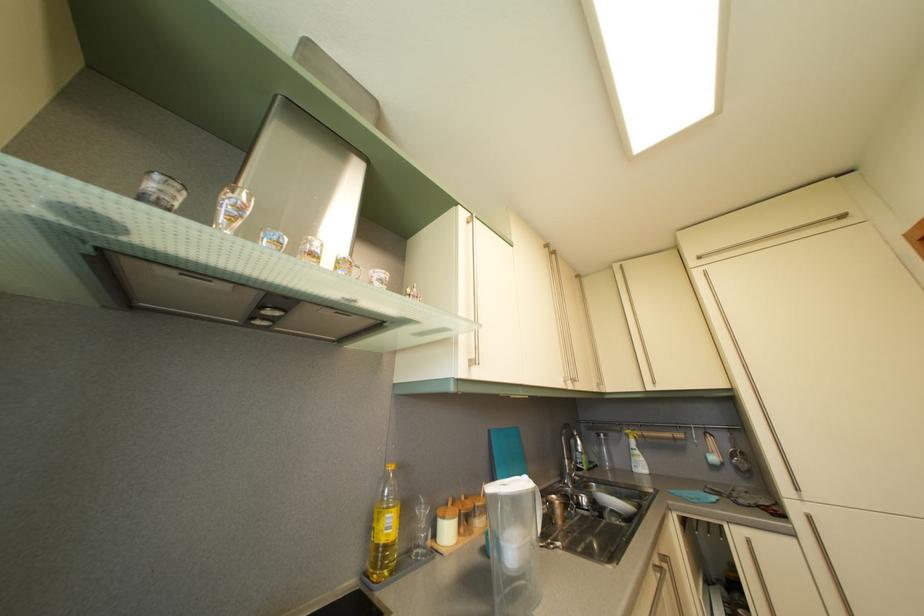
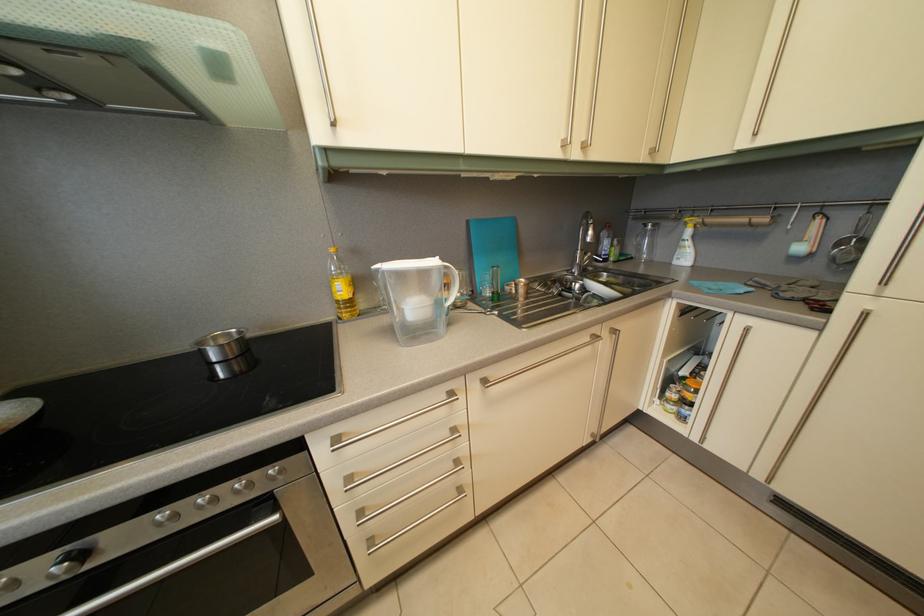
The images are taken continuously from a first-person perspective. In which direction is your viewpoint rotating?

The camera rotated toward left-down.